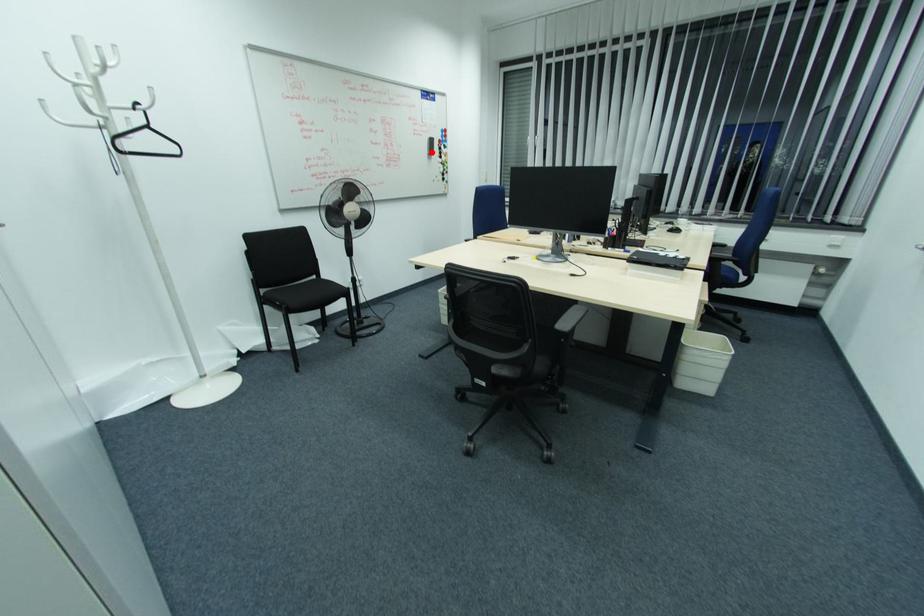
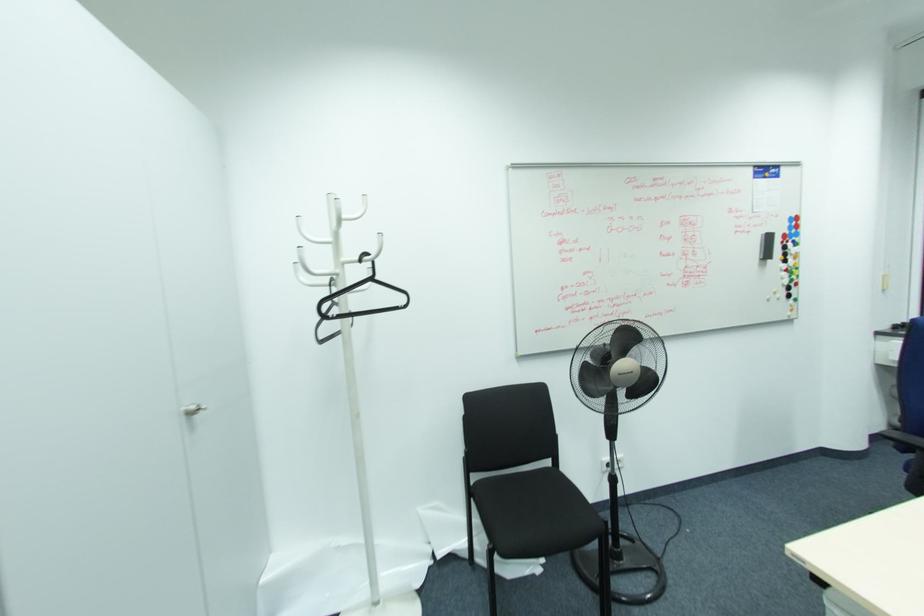
Find the pixel in the second image that matches the highlighted location in the first image.

(768, 256)